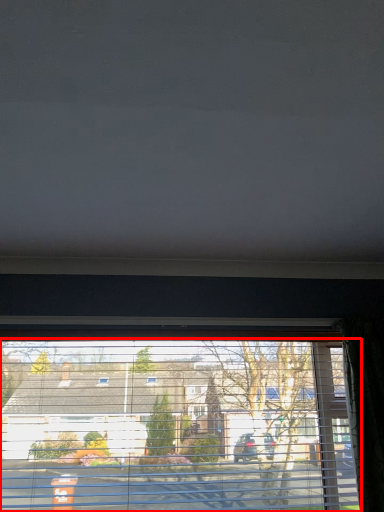
Question: From the image's perspective, what is the correct spatial relationship of window (annotated by the red box) in relation to blind?

Choices:
 (A) above
 (B) below

Answer: (B)